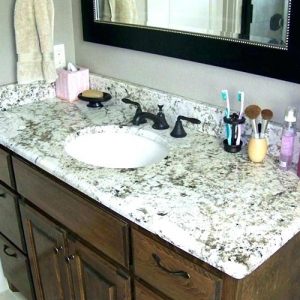
Locate an element on the screen. electric outlet is located at coordinates (60, 59).